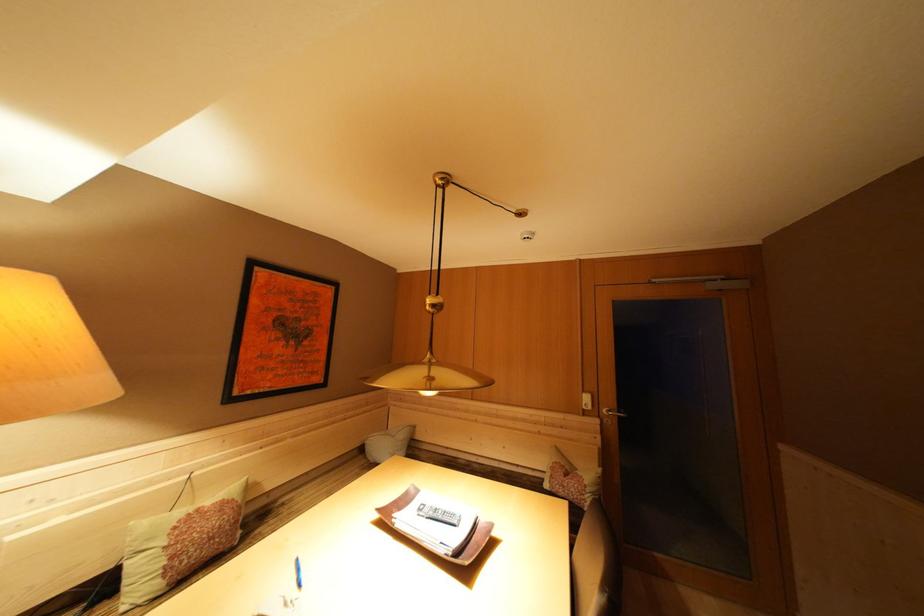
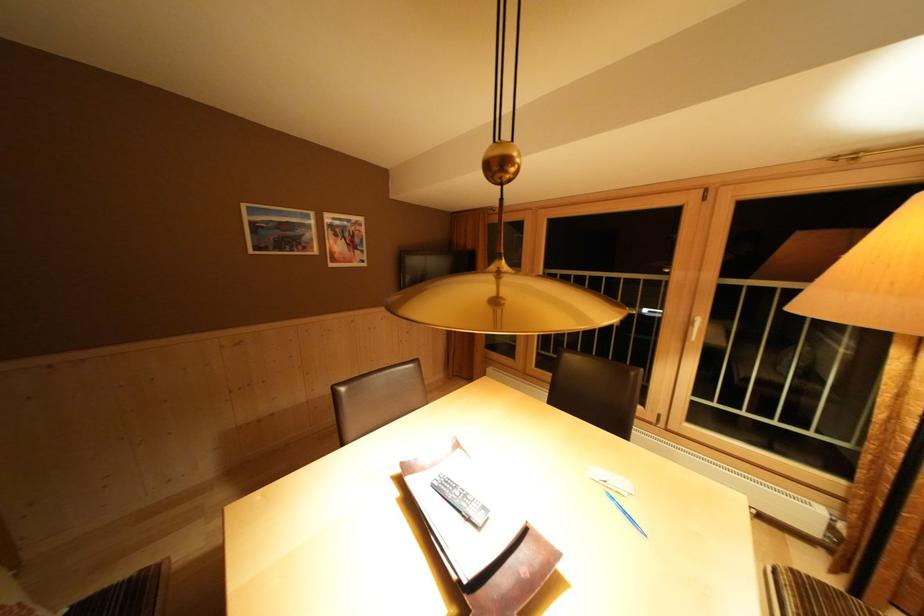
The point at (306, 575) is marked in the first image. Where is the corresponding point in the second image?

(633, 517)